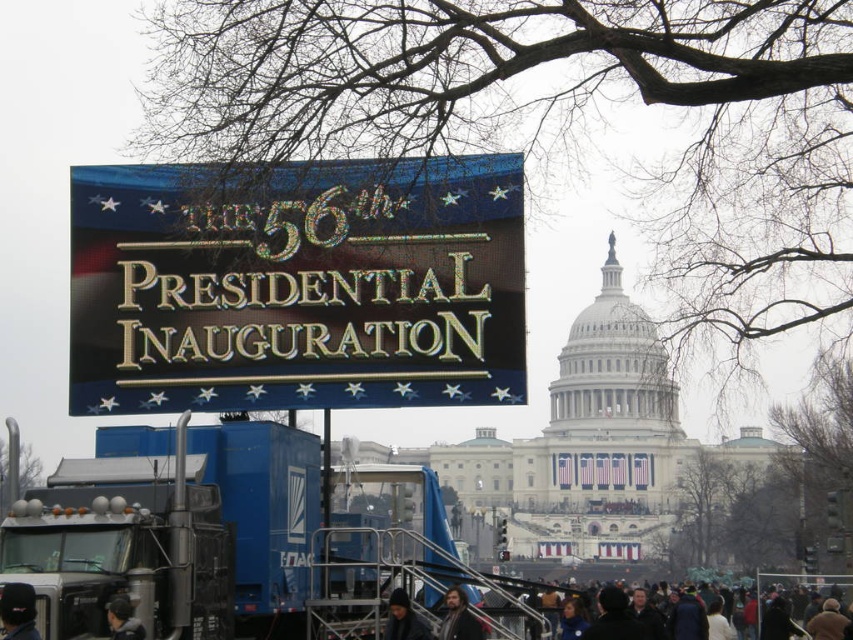
Question: Can you confirm if shiny metallic sign at center is thinner than blue metallic trailer truck at lower left?

Choices:
 (A) no
 (B) yes

Answer: (A)

Question: Considering the real-world distances, which object is closest to the dark brown leather jacket at lower center?

Choices:
 (A) blue metallic trailer truck at lower left
 (B) shiny metallic sign at center
 (C) black fabric cap at lower left

Answer: (A)

Question: Does dark gray clothing at lower center have a smaller size compared to dark brown leather jacket at lower center?

Choices:
 (A) no
 (B) yes

Answer: (A)

Question: Which object is the farthest from the dark brown leather jacket at lower center?

Choices:
 (A) dark gray jacket at lower left
 (B) blue metallic trailer truck at lower left

Answer: (A)

Question: Which point is closer to the camera?

Choices:
 (A) blue metallic trailer truck at lower left
 (B) dark brown leather jacket at lower center
 (C) dark gray knit hat at lower center

Answer: (A)

Question: Does black fabric cap at lower left appear over dark gray knit hat at lower center?

Choices:
 (A) no
 (B) yes

Answer: (B)